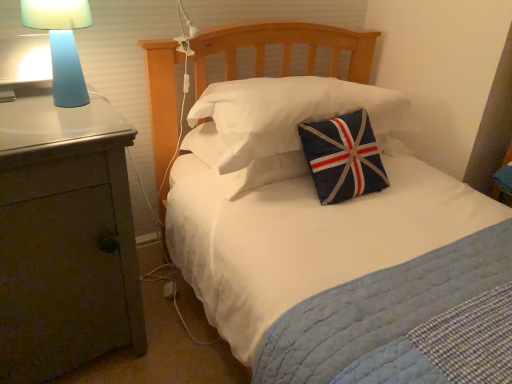
Question: Could blue matte lamp at left be considered to be inside navy blue fabric pillow at center, positioned as the first pillow in top-to-bottom order?

Choices:
 (A) yes
 (B) no

Answer: (B)

Question: Can you confirm if navy blue fabric pillow at center, positioned as the first pillow in top-to-bottom order, is bigger than blue matte lamp at left?

Choices:
 (A) yes
 (B) no

Answer: (A)

Question: Is navy blue fabric pillow at center, positioned as the first pillow in top-to-bottom order, at the right side of blue matte lamp at left?

Choices:
 (A) no
 (B) yes

Answer: (B)

Question: From the image's perspective, is navy blue fabric pillow at center, which appears as the 2th pillow when ordered from the bottom, located above blue matte lamp at left?

Choices:
 (A) no
 (B) yes

Answer: (A)

Question: Is the position of navy blue fabric pillow at center, which appears as the 2th pillow when ordered from the bottom, more distant than that of blue matte lamp at left?

Choices:
 (A) yes
 (B) no

Answer: (A)

Question: Is navy blue fabric pillow at center, positioned as the first pillow in top-to-bottom order, closer to camera compared to blue matte lamp at left?

Choices:
 (A) no
 (B) yes

Answer: (A)

Question: Would you say matte gray nightstand at left is outside blue matte lamp at left?

Choices:
 (A) yes
 (B) no

Answer: (A)

Question: Does matte gray nightstand at left have a greater height compared to blue matte lamp at left?

Choices:
 (A) no
 (B) yes

Answer: (B)

Question: Is matte gray nightstand at left aimed at blue matte lamp at left?

Choices:
 (A) no
 (B) yes

Answer: (A)

Question: From a real-world perspective, is matte gray nightstand at left below blue matte lamp at left?

Choices:
 (A) yes
 (B) no

Answer: (A)

Question: Is matte gray nightstand at left smaller than blue matte lamp at left?

Choices:
 (A) no
 (B) yes

Answer: (A)

Question: Can you confirm if matte gray nightstand at left is bigger than blue matte lamp at left?

Choices:
 (A) no
 (B) yes

Answer: (B)

Question: Is blue matte lamp at left positioned with its back to matte gray nightstand at left?

Choices:
 (A) yes
 (B) no

Answer: (B)